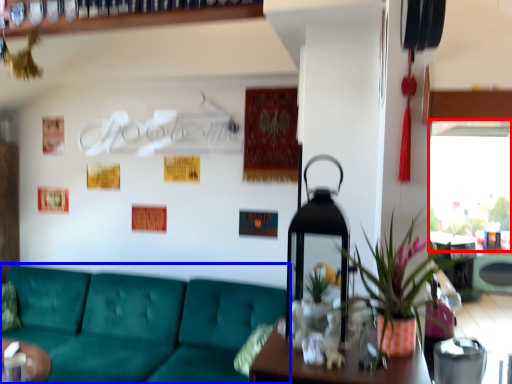
Question: Which object is further to the camera taking this photo, window screen (highlighted by a red box) or studio couch (highlighted by a blue box)?

Choices:
 (A) window screen
 (B) studio couch

Answer: (A)